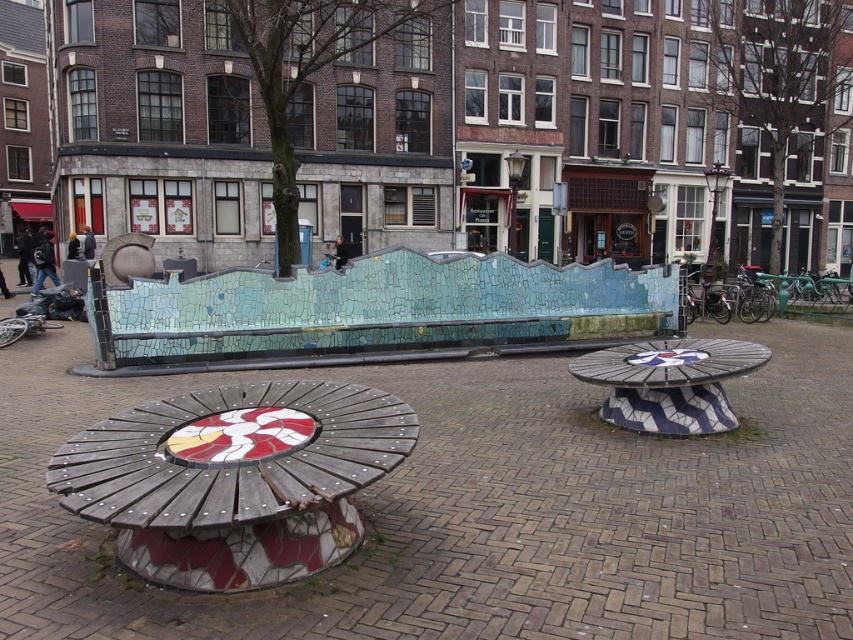
Who is shorter, wooden mosaic bench at lower left or white glossy mosaic table at center?

wooden mosaic bench at lower left

Between wooden mosaic bench at lower left and white glossy mosaic table at center, which one is positioned higher?

white glossy mosaic table at center is above.

Between point (84, 452) and point (726, 339), which one is positioned behind?

The point (726, 339) is behind.

Where is `wooden mosaic bench at lower left`? This screenshot has height=640, width=853. wooden mosaic bench at lower left is located at coordinates (235, 480).